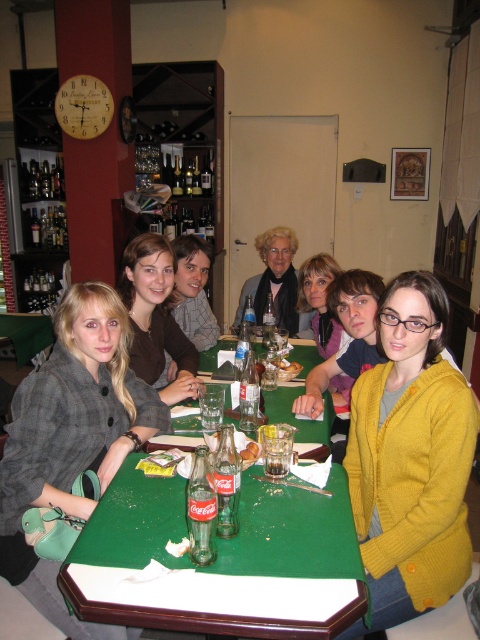
Question: Is mustard yellow cardigan at center to the right of brown wool sweater at center from the viewer's perspective?

Choices:
 (A) no
 (B) yes

Answer: (B)

Question: Can you confirm if gray wool coat at center is smaller than brown wool sweater at center?

Choices:
 (A) yes
 (B) no

Answer: (B)

Question: Considering the real-world distances, which object is closest to the brown wool sweater at center?

Choices:
 (A) white crumbly bread at center
 (B) yellow matte bread at table center
 (C) green fabric table at lower left

Answer: (A)

Question: Which of the following is the closest to the observer?

Choices:
 (A) (325, 330)
 (B) (291, 234)

Answer: (A)

Question: Which of the following is the closest to the observer?

Choices:
 (A) (335, 262)
 (B) (374, 602)
 (C) (23, 362)

Answer: (B)

Question: Is matte purple sweater at center positioned at the back of yellow matte bread at table center?

Choices:
 (A) no
 (B) yes

Answer: (B)